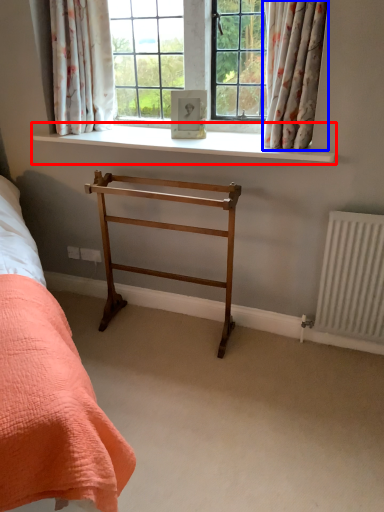
Question: Which of the following is the farthest to the observer, window sill (highlighted by a red box) or curtain (highlighted by a blue box)?

Choices:
 (A) window sill
 (B) curtain

Answer: (A)